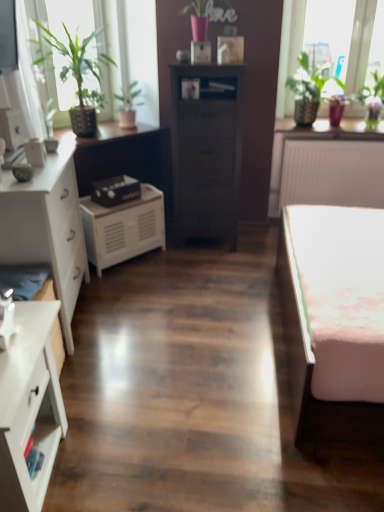
Question: Is point (72, 42) positioned closer to the camera than point (120, 97)?

Choices:
 (A) closer
 (B) farther

Answer: (A)

Question: In terms of width, does green leafy plant at upper left, which is the 1th houseplant in left-to-right order, look wider or thinner when compared to green matte plant at upper left, which appears as the second houseplant when viewed from the left?

Choices:
 (A) wide
 (B) thin

Answer: (B)

Question: Which of these objects is positioned farthest from the green leafy plant at upper left, the third houseplant positioned from the right?

Choices:
 (A) white matte radiator at upper right
 (B) pink fabric bed at right
 (C) white glossy chest of drawers at lower left, which ranks as the 2th chest of drawers in right-to-left order
 (D) white matte cabinet at center
 (E) green leafy plant at upper right

Answer: (C)

Question: Which object is positioned farthest from the green matte plant at upper left, which appears as the second houseplant when viewed from the left?

Choices:
 (A) green leafy plant at upper left, which is the 1th houseplant in left-to-right order
 (B) pink fabric bed at right
 (C) white matte radiator at upper right
 (D) white glossy chest of drawers at lower left, which is the third chest of drawers in back-to-front order
 (E) white matte chest of drawers at left, positioned as the third chest of drawers in right-to-left order

Answer: (D)